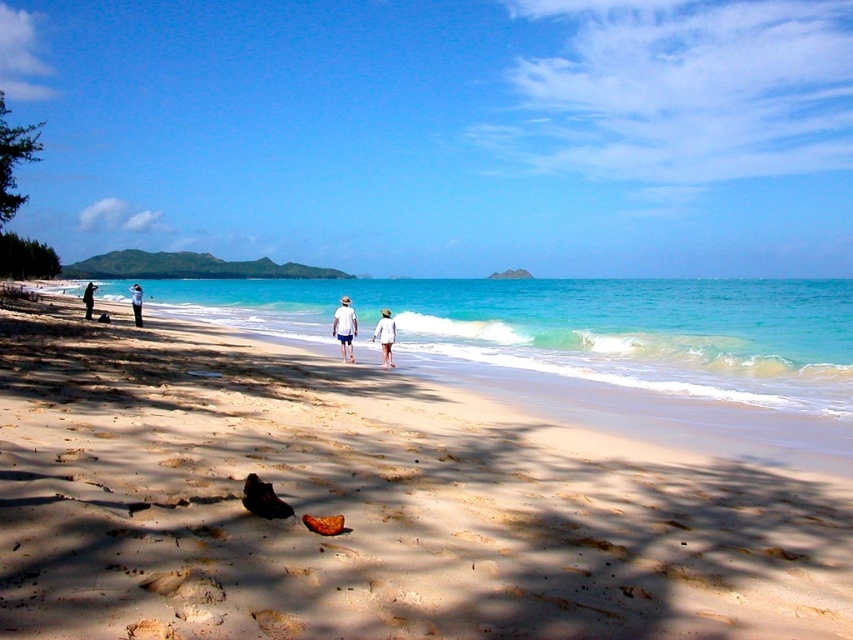
Based on the photo, you are standing on the sandy beach at lower center and want to wave to the person wearing the white cotton shirt at left. Which direction should you face to ensure they see your greeting?

Since the sandy beach at lower center is closer to the viewer than the white cotton shirt at left, you should face towards the left side of the frame to wave at the person wearing the white cotton shirt at left.